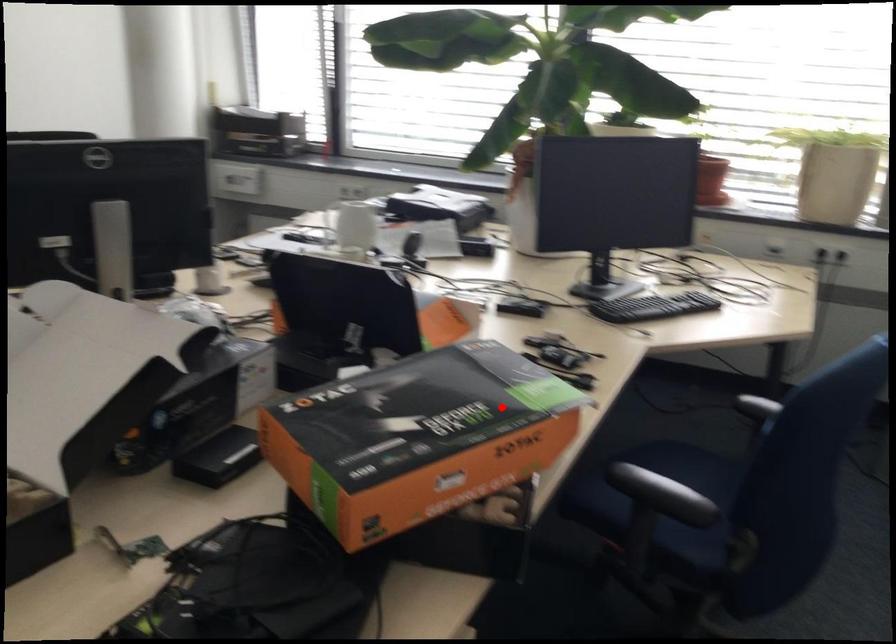
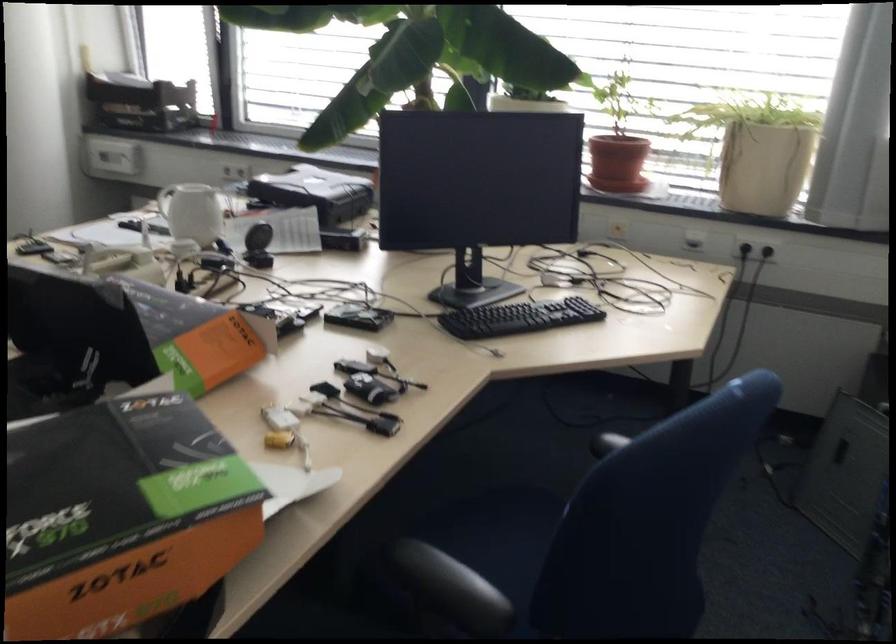
Question: I am providing you with two images of the same scene from different viewpoints. Given a red point in image1, look at the same physical point in image2. Is it:

Choices:
 (A) Closer to the viewpoint
 (B) Farther from the viewpoint

Answer: (A)